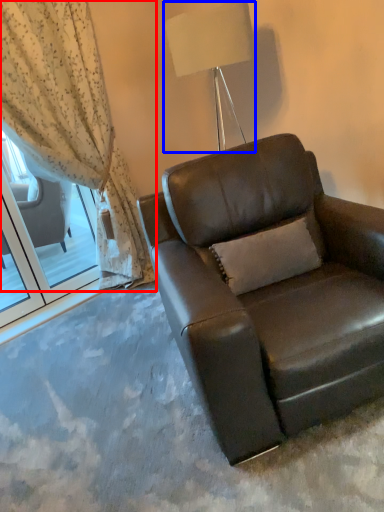
Question: Among these objects, which one is farthest to the camera, curtain (highlighted by a red box) or lamp (highlighted by a blue box)?

Choices:
 (A) curtain
 (B) lamp

Answer: (A)